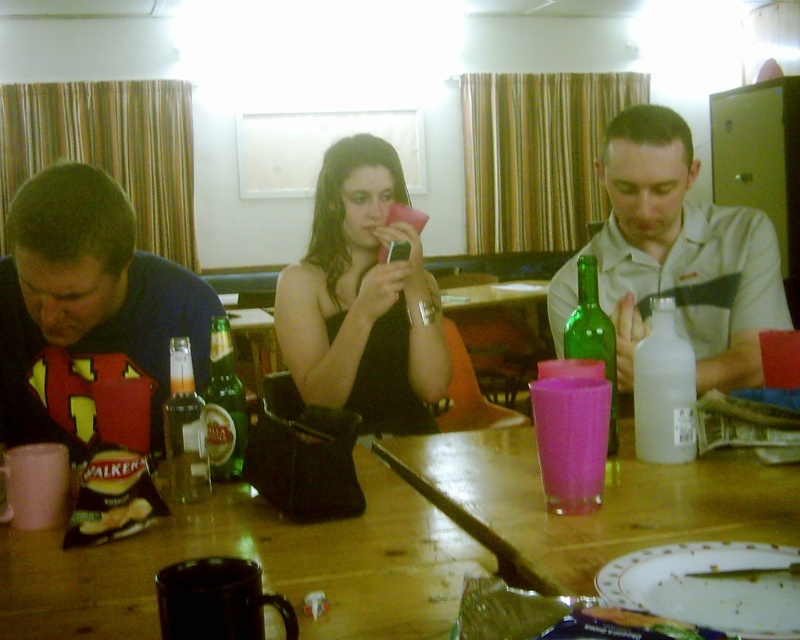
The image size is (800, 640). What do you see at coordinates (598, 508) in the screenshot? I see `pink plastic cup at center` at bounding box center [598, 508].

Is point (414, 452) farther from viewer compared to point (526, 621)?

Yes, point (414, 452) is farther from viewer.

At what (x,y) coordinates should I click in order to perform the action: click on pink plastic cup at center. Please return your answer as a coordinate pair (x, y). The image size is (800, 640). Looking at the image, I should click on (598, 508).

Can you confirm if matte white bottle at center right is thinner than green glass bottle at center?

No, matte white bottle at center right is not thinner than green glass bottle at center.

Between point (704, 248) and point (601, 308), which one is positioned in front?

Point (601, 308) is more forward.

Locate an element on the screen. Image resolution: width=800 pixels, height=640 pixels. matte white bottle at center right is located at coordinates (682, 253).

Identify the location of matte black phone at center. (362, 301).

Which is behind, point (61, 365) or point (464, 472)?

The point (61, 365) is more distant.

This screenshot has width=800, height=640. I want to click on matte black phone at center, so click(x=362, y=301).